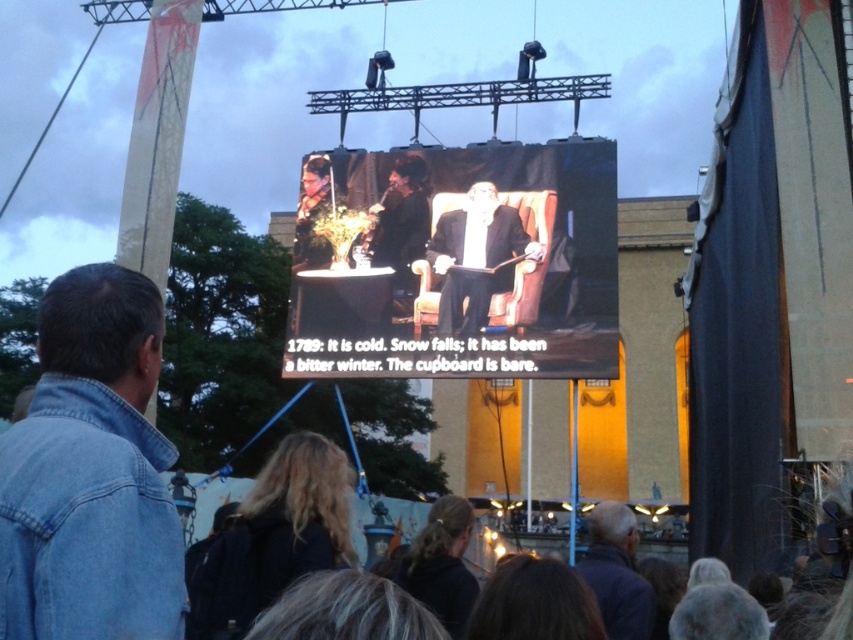
Does matte black chair at center have a greater height compared to denim jacket at lower left?

No, matte black chair at center is not taller than denim jacket at lower left.

Which of these two, matte black chair at center or denim jacket at lower left, stands shorter?

With less height is matte black chair at center.

Who is more forward, (567, 236) or (86, 580)?

Point (86, 580) is more forward.

This screenshot has height=640, width=853. I want to click on matte black chair at center, so click(x=457, y=262).

Which is more to the left, denim jacket at lower left or dark blue jacket at lower right?

Positioned to the left is denim jacket at lower left.

Is point (49, 564) closer to camera compared to point (598, 538)?

Yes, point (49, 564) is in front of point (598, 538).

Where is `denim jacket at lower left`? This screenshot has height=640, width=853. denim jacket at lower left is located at coordinates (91, 472).

Who is shorter, matte black chair at center or smooth black suit at center?

Standing shorter between the two is smooth black suit at center.

What do you see at coordinates (457, 262) in the screenshot?
I see `matte black chair at center` at bounding box center [457, 262].

Consider the image. Who is more distant from viewer, (x=425, y=355) or (x=505, y=275)?

The point (x=505, y=275) is more distant.

Locate an element on the screen. The height and width of the screenshot is (640, 853). matte black chair at center is located at coordinates 457,262.